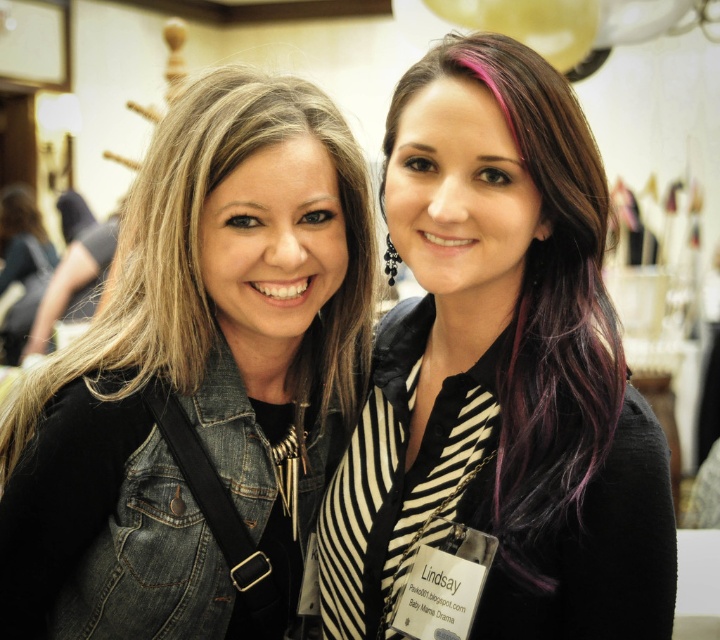
From the picture: You are organizing a clothing donation drive and need to categorize items by size. You have a denim jacket at left and a purplehair at right. Which item is larger in size?

The denim jacket at left is bigger than purplehair at right, so the denim jacket at left should be categorized as the larger item.

You are standing in front of the image and want to locate the denim jacket at left. Where is it positioned in terms of coordinates?

The denim jacket at left is located at coordinates point (197, 376).

You are at an event and want to greet the person wearing a name tag. You are currently standing to the left of the denim jacket at left. Which direction should you move to reach the purplehair at right?

Since the denim jacket at left is to the left of purplehair at right, you are already positioned to the left of the denim jacket. To reach the purplehair at right, you should move to the right.